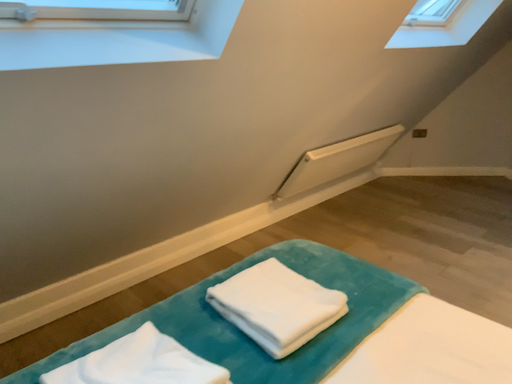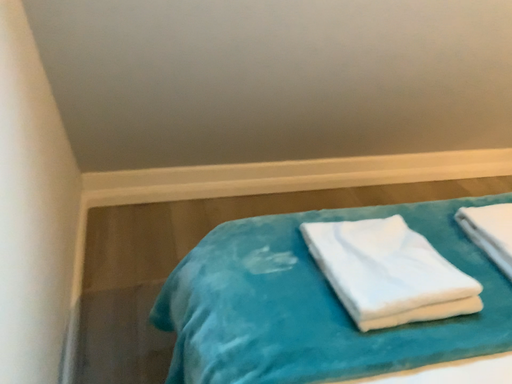
Question: How did the camera likely rotate when shooting the video?

Choices:
 (A) rotated right
 (B) rotated left

Answer: (B)